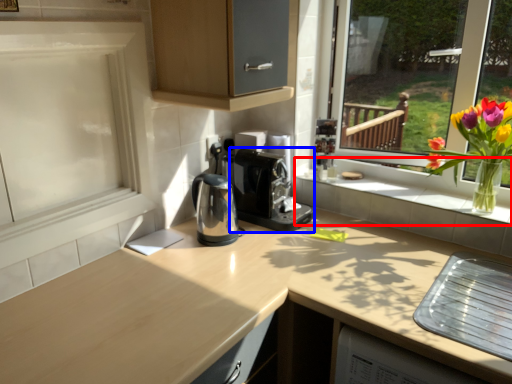
Question: Which object is closer to the camera taking this photo, window sill (highlighted by a red box) or coffee machine (highlighted by a blue box)?

Choices:
 (A) window sill
 (B) coffee machine

Answer: (A)